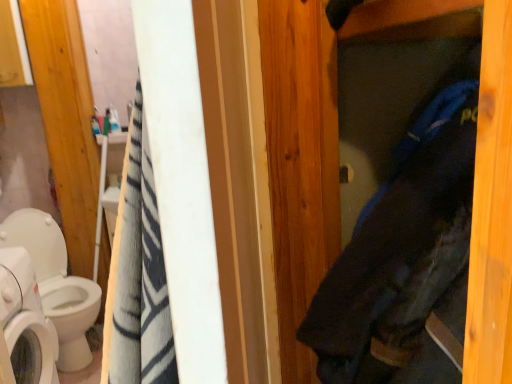
Question: From the image's perspective, relative to white glossy toilet at left, is white glossy washing machine at lower left above or below?

Choices:
 (A) below
 (B) above

Answer: (A)

Question: Does point (31, 296) appear closer or farther from the camera than point (51, 236)?

Choices:
 (A) closer
 (B) farther

Answer: (A)

Question: Which object is positioned closest to the white glossy washing machine at lower left?

Choices:
 (A) dark blue fabric at center
 (B) white glossy toilet at left

Answer: (B)

Question: Considering the real-world distances, which object is closest to the white glossy toilet at left?

Choices:
 (A) dark blue fabric at center
 (B) white glossy washing machine at lower left

Answer: (B)